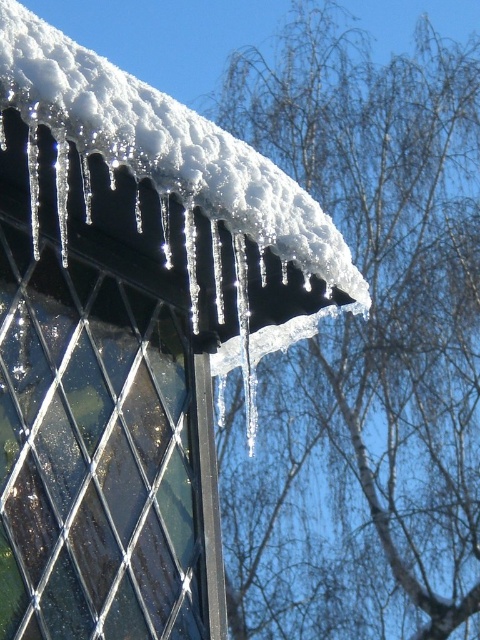
Who is positioned more to the left, white snow at upper center or clear ice icicles at upper left?

clear ice icicles at upper left is more to the left.

You are a GUI agent. You are given a task and a screenshot of the screen. Output one action in this format:
    pyautogui.click(x=<x>, y=<y>)
    Task: Click on the white snow at upper center
    The image size is (480, 640).
    Given the screenshot: What is the action you would take?
    pyautogui.click(x=365, y=348)

Between point (434, 464) and point (210, 188), which one is positioned in front?

Positioned in front is point (210, 188).

This screenshot has height=640, width=480. In order to click on white snow at upper center in this screenshot , I will do `click(365, 348)`.